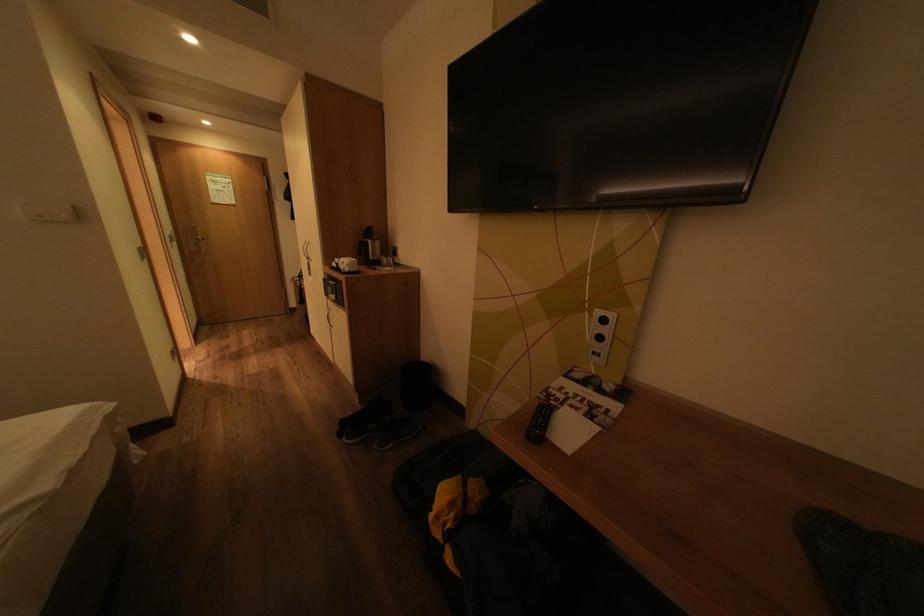
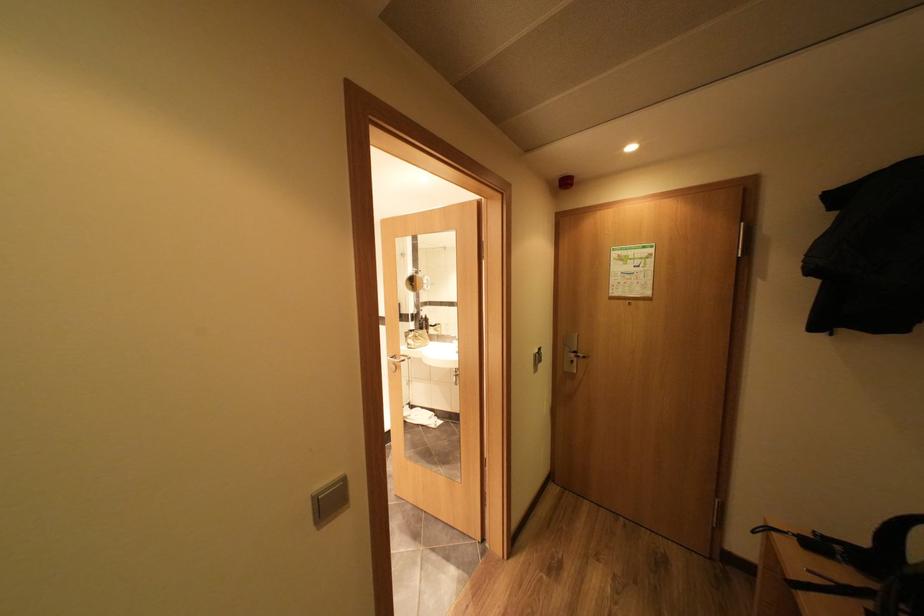
The point at (227,207) is marked in the first image. Where is the corresponding point in the second image?

(626, 302)